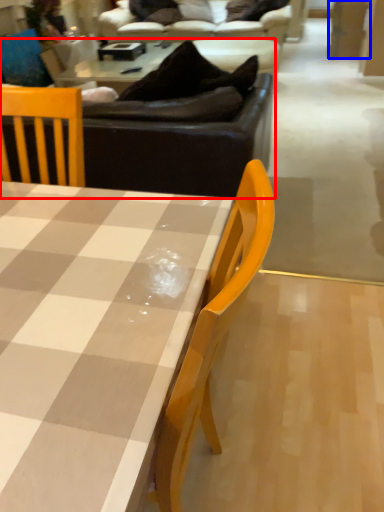
Question: Which object is closer to the camera taking this photo, studio couch (highlighted by a red box) or plywood (highlighted by a blue box)?

Choices:
 (A) studio couch
 (B) plywood

Answer: (A)